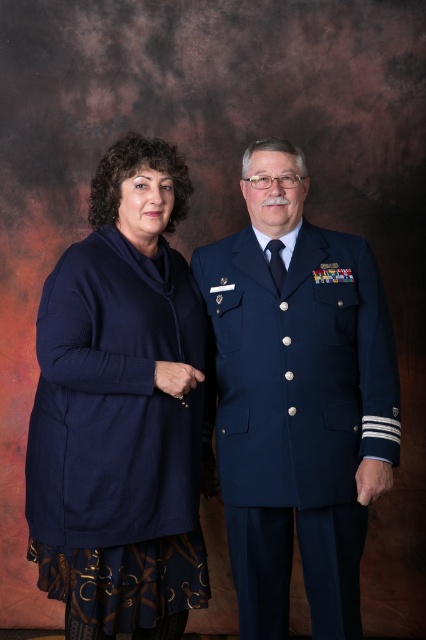
Based on the photo, you are a fashion designer analyzing the image. You need to determine which item of clothing is taller between the navy knit sweater at left and the navy blue uniform at center. Which one is taller?

The navy knit sweater at left is taller than the navy blue uniform at center.

You are a photographer setting up for a group photo. You need to ensure that both the navy knit sweater at left and the navy blue uniform at center are visible in the frame. Based on their positions, which one might be partially obscured if the camera angle is too low?

The navy knit sweater at left is positioned under the navy blue uniform at center, so if the camera angle is too low, the navy knit sweater at left might be partially obscured by the navy blue uniform at center.

In the scene shown: You are an artist analyzing the composition of this image. There are two points marked in the scene, point (92, 525) and point (291, 342). Which of these two points is positioned closer to the viewer?

Point (92, 525) is closer to the viewer than point (291, 342).